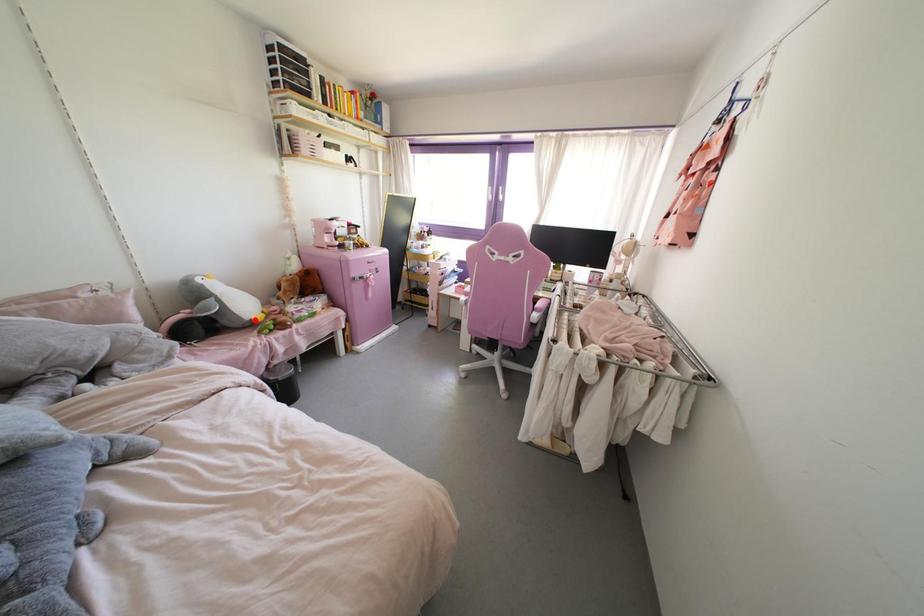
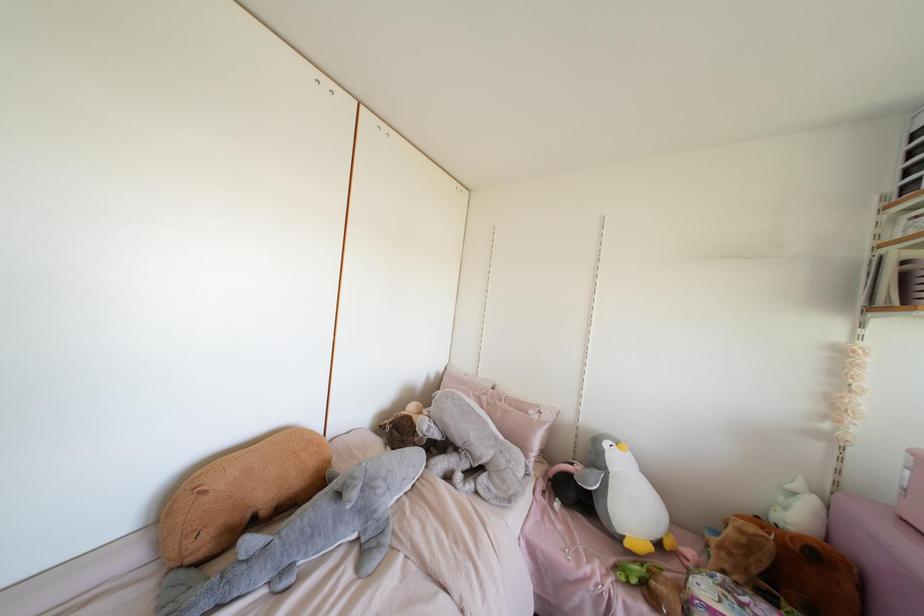
Where in the second image is the point corresponding to the highlighted location from the first image?

(626, 544)